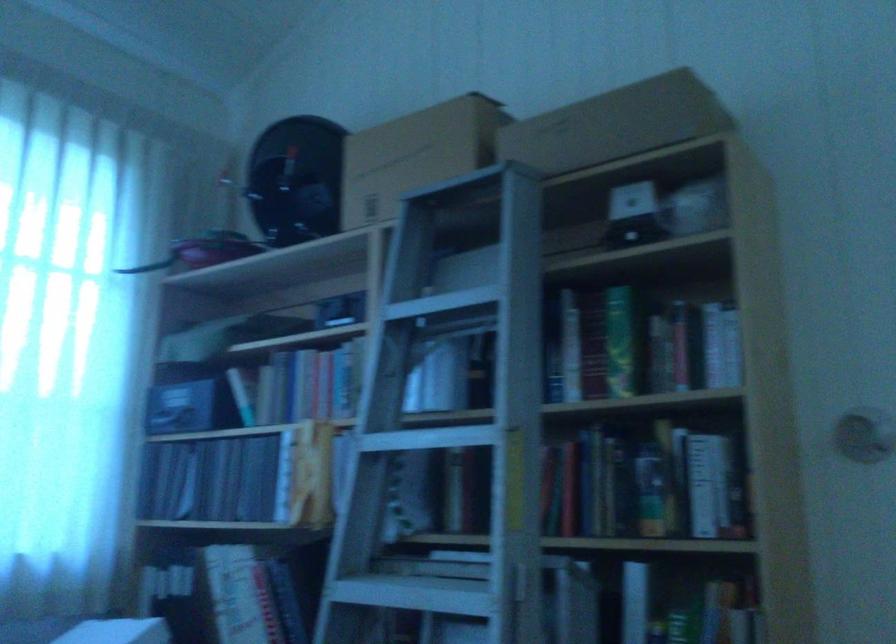
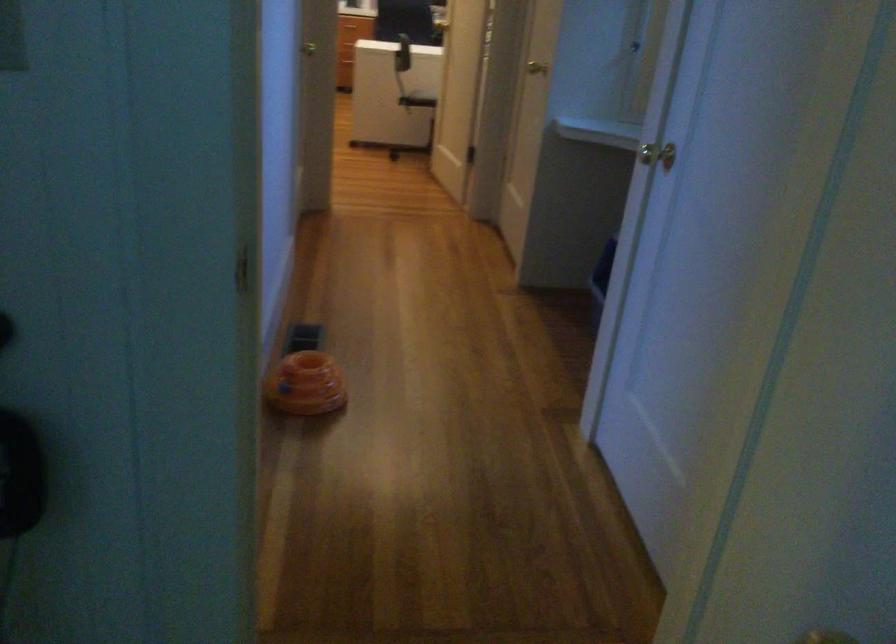
The first image is from the beginning of the video and the second image is from the end. How did the camera likely rotate when shooting the video?

The camera's rotation is toward right-down.